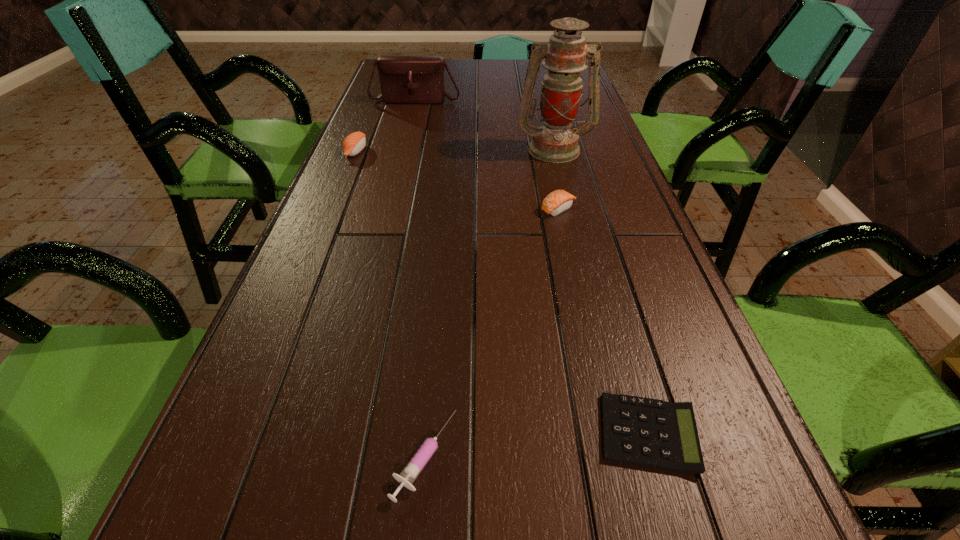
Where is `unoccupied position between the third tallest object and the tallest object`? This screenshot has height=540, width=960. unoccupied position between the third tallest object and the tallest object is located at coordinates (455, 150).

Identify the location of unoccupied area between the farthest object and the taller sushi. (386, 126).

Where is `free area in between the syringe and the tallest object`? free area in between the syringe and the tallest object is located at coordinates (489, 303).

Locate an element on the screen. This screenshot has width=960, height=540. object that is the second closest one to the fourth tallest object is located at coordinates (645, 432).

Image resolution: width=960 pixels, height=540 pixels. I want to click on the second closest object to the syringe, so click(558, 201).

Locate an element on the screen. This screenshot has width=960, height=540. vacant position in the image that satisfies the following two spatial constraints: 1. on the front flap of the shortest object; 2. on the left side of the second tallest object is located at coordinates (328, 433).

You are a GUI agent. You are given a task and a screenshot of the screen. Output one action in this format:
    pyautogui.click(x=<x>, y=<y>)
    Task: Click on the vacant space that satisfies the following two spatial constraints: 1. on the front flap of the oil lamp; 2. on the right side of the fifth shortest object
    This screenshot has width=960, height=540.
    Given the screenshot: What is the action you would take?
    pyautogui.click(x=402, y=149)

The image size is (960, 540). Identify the location of free spot that satisfies the following two spatial constraints: 1. on the front side of the shorter sushi; 2. on the left side of the calculator. (608, 433).